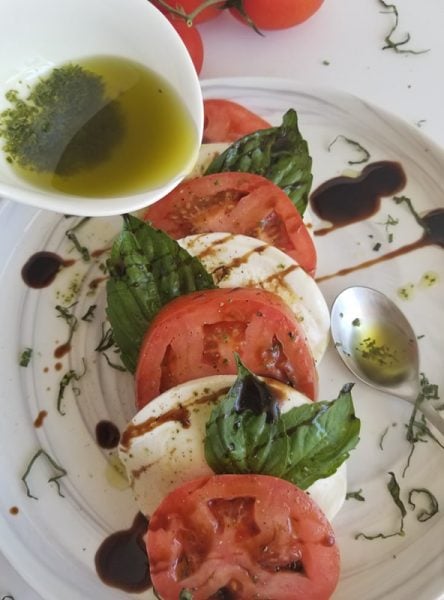
This screenshot has height=600, width=444. Find the location of `whole tomatoes sitting on tables`. whole tomatoes sitting on tables is located at coordinates (294, 7), (197, 36).